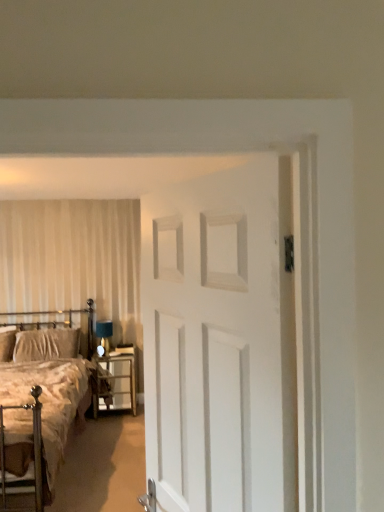
Question: Does metallic silver nightstand at lower center appear on the right side of velvet beige pillow at left?

Choices:
 (A) no
 (B) yes

Answer: (B)

Question: Does metallic silver nightstand at lower center contain velvet beige pillow at left?

Choices:
 (A) yes
 (B) no

Answer: (B)

Question: Are metallic silver nightstand at lower center and velvet beige pillow at left making contact?

Choices:
 (A) yes
 (B) no

Answer: (B)

Question: Would you say metallic silver nightstand at lower center is outside velvet beige pillow at left?

Choices:
 (A) yes
 (B) no

Answer: (A)

Question: Is metallic silver nightstand at lower center at the left side of velvet beige pillow at left?

Choices:
 (A) no
 (B) yes

Answer: (A)

Question: In the image, is metallic silver headboard at left on the left side or the right side of white matte door at center?

Choices:
 (A) left
 (B) right

Answer: (A)

Question: Considering the positions of metallic silver headboard at left and white matte door at center in the image, is metallic silver headboard at left bigger or smaller than white matte door at center?

Choices:
 (A) big
 (B) small

Answer: (A)

Question: In terms of width, does metallic silver headboard at left look wider or thinner when compared to white matte door at center?

Choices:
 (A) thin
 (B) wide

Answer: (B)

Question: Is metallic silver headboard at left situated inside white matte door at center or outside?

Choices:
 (A) inside
 (B) outside

Answer: (B)

Question: Is metallic silver headboard at left to the left or to the right of velvet beige pillow at left in the image?

Choices:
 (A) right
 (B) left

Answer: (A)

Question: Is metallic silver headboard at left wider or thinner than velvet beige pillow at left?

Choices:
 (A) wide
 (B) thin

Answer: (A)

Question: From their relative heights in the image, would you say metallic silver headboard at left is taller or shorter than velvet beige pillow at left?

Choices:
 (A) tall
 (B) short

Answer: (A)

Question: Is metallic silver headboard at left inside the boundaries of velvet beige pillow at left, or outside?

Choices:
 (A) inside
 (B) outside

Answer: (A)

Question: From a real-world perspective, relative to metallic silver headboard at left, is velvet beige pillow at left vertically above or below?

Choices:
 (A) above
 (B) below

Answer: (B)

Question: Choose the correct answer: Is velvet beige pillow at left inside metallic silver headboard at left or outside it?

Choices:
 (A) outside
 (B) inside

Answer: (B)